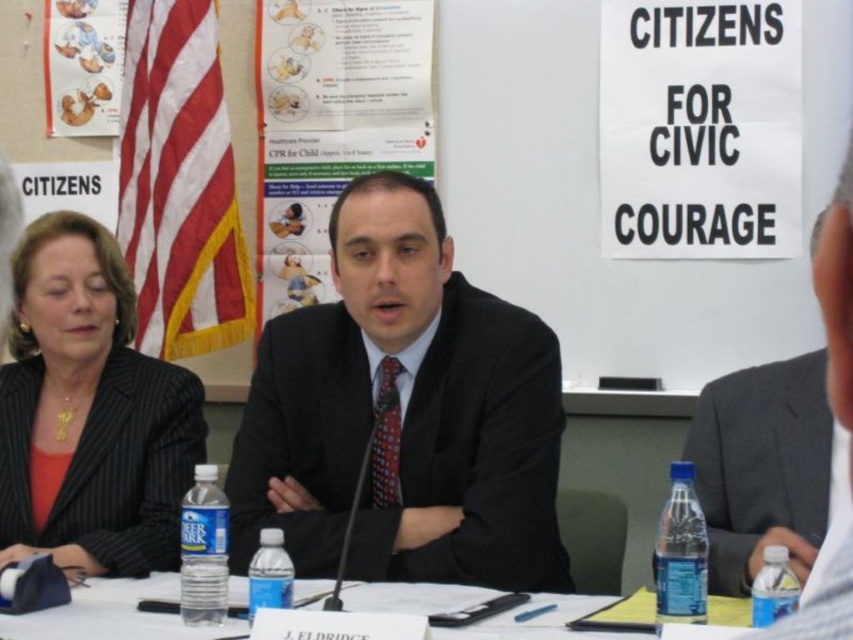
You are sitting at the table in the scene and need to reach both the point at (262,84) and the point at (514,624). Which point is closer to you?

Point (514,624) is closer to you because it is in front of point (262,84).

You are attending a conference and see the black suit at center and the paper with printed text at center. Which object is closer to the bottom of the image?

The black suit at center is closer to the bottom of the image because it is positioned under the paper with printed text at center.

You are organizing a conference and need to ensure that the black paper sign at upper right and the black matte suit at right are visible to the audience. Based on their sizes, which one is more likely to be seen from the back of the room?

The black paper sign at upper right is much taller than the black matte suit at right, so it is more likely to be seen from the back of the room.